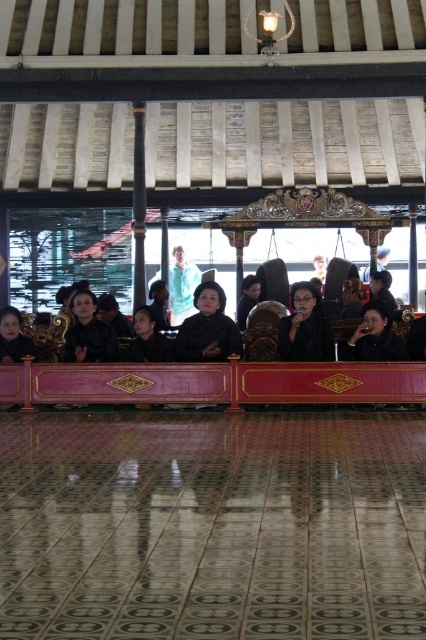
You are attending a cultural event and notice the polished wood rail at center and the black glossy hair at center. Based on their positions, which one is closer to the ceiling?

The black glossy hair at center is closer to the ceiling because the polished wood rail at center is below it.

You are a guest at this event and want to see the people behind the polished wood rail at center. Can you see the black glossy hair at center through the rail?

The polished wood rail at center is in front of the black glossy hair at center, so the rail blocks the view of the black glossy hair at center.

You are an event planner arranging decorations for a ceremony. You have a polished wood rail at center and a light blue fabric at center. Which object takes up more space in the scene?

The light blue fabric at center takes up more space than the polished wood rail at center because the polished wood rail at center occupies less space than light blue fabric at center.